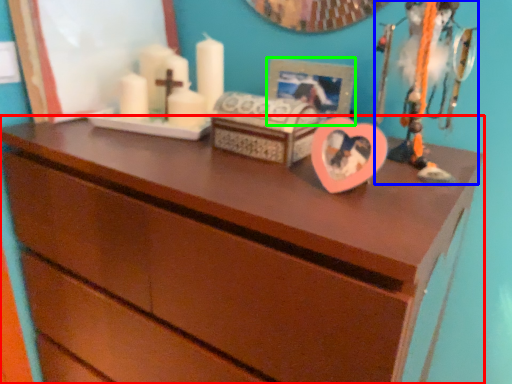
Question: Considering the real-world distances, which object is farthest from chest of drawers (highlighted by a red box)? toy (highlighted by a blue box) or picture frame (highlighted by a green box)?

Choices:
 (A) toy
 (B) picture frame

Answer: (B)